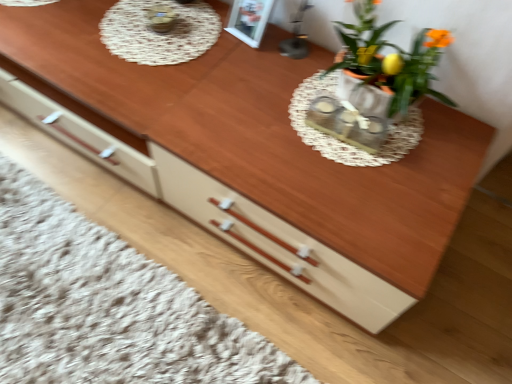
This screenshot has height=384, width=512. What are the coordinates of `blank space to the left of white lace doily at upper center` in the screenshot? It's located at (61, 32).